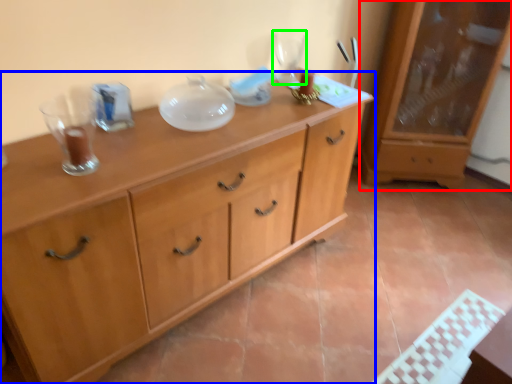
Question: Which object is the closest to the cabinetry (highlighted by a red box)? Choose among these: chest of drawers (highlighted by a blue box) or wine glass (highlighted by a green box).

Choices:
 (A) chest of drawers
 (B) wine glass

Answer: (B)